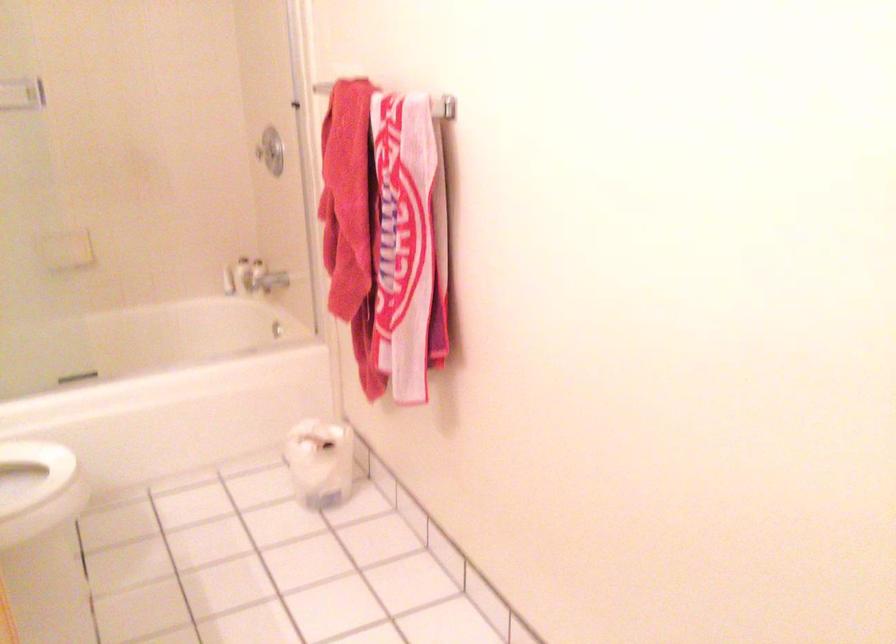
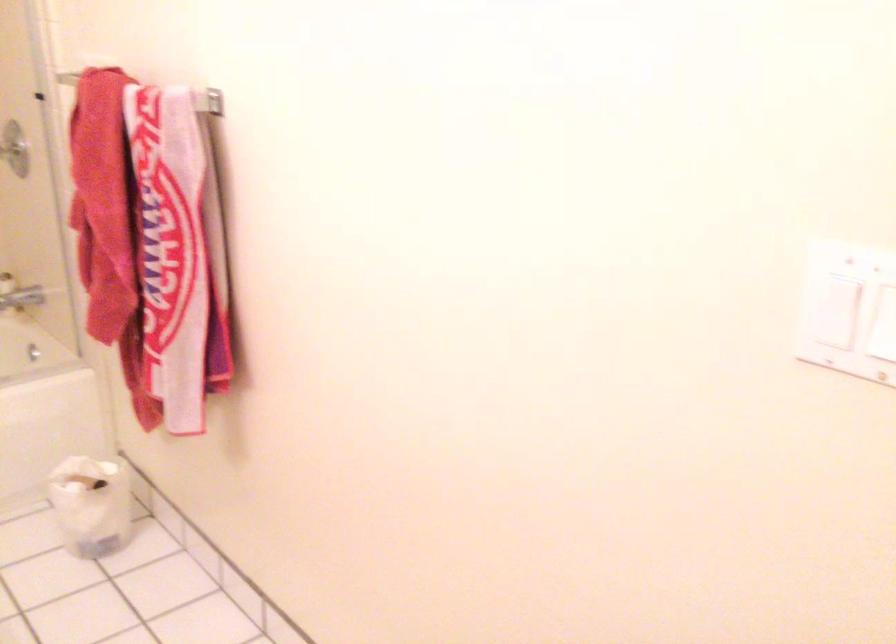
In the second image, find the point that corresponds to pixel 265 281 in the first image.

(20, 299)